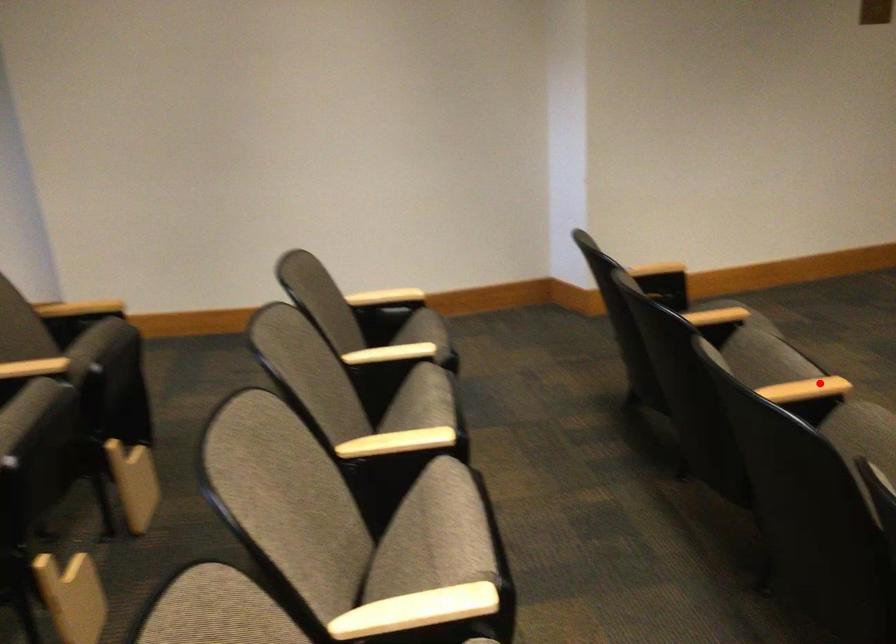
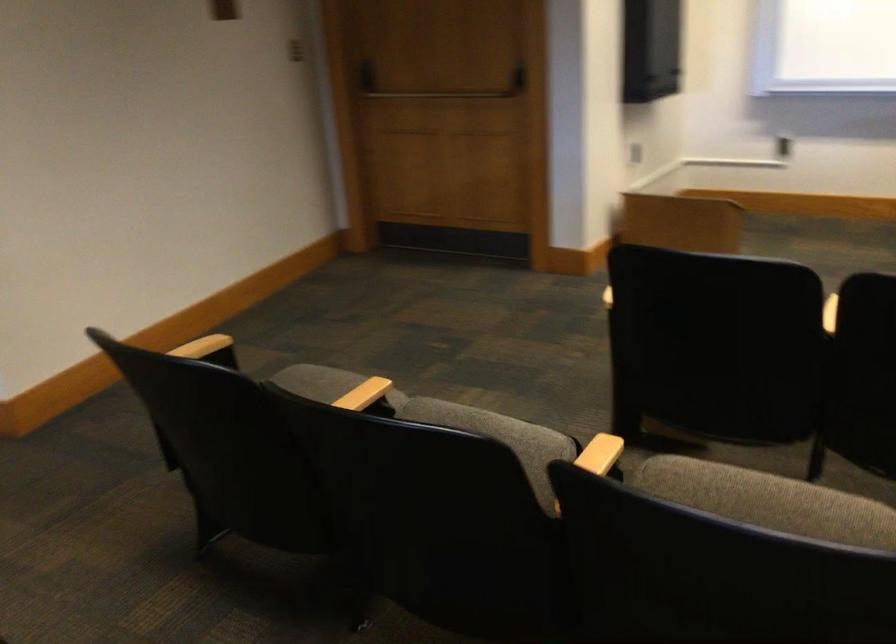
The point at the highlighted location is marked in the first image. Where is the corresponding point in the second image?

(600, 455)